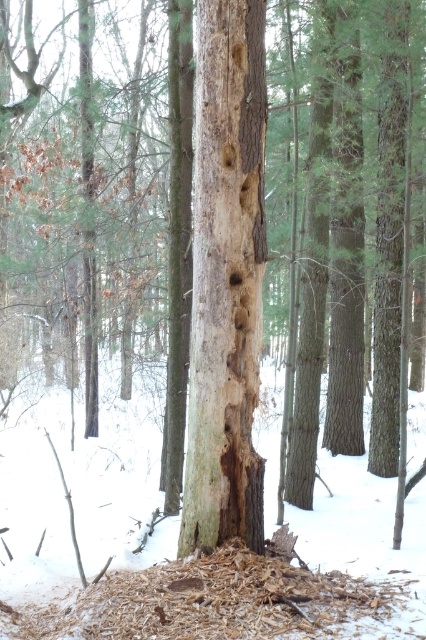
Question: Which object appears farthest from the camera in this image?

Choices:
 (A) white powdery snow at center
 (B) light brown wood at center

Answer: (B)

Question: Which object is farther from the camera taking this photo?

Choices:
 (A) light brown wood at center
 (B) white powdery snow at center

Answer: (A)

Question: Can you confirm if white powdery snow at center is bigger than light brown wood at center?

Choices:
 (A) no
 (B) yes

Answer: (B)

Question: Is white powdery snow at center wider than light brown wood at center?

Choices:
 (A) no
 (B) yes

Answer: (B)

Question: Considering the relative positions of white powdery snow at center and light brown wood at center in the image provided, where is white powdery snow at center located with respect to light brown wood at center?

Choices:
 (A) right
 (B) left

Answer: (A)